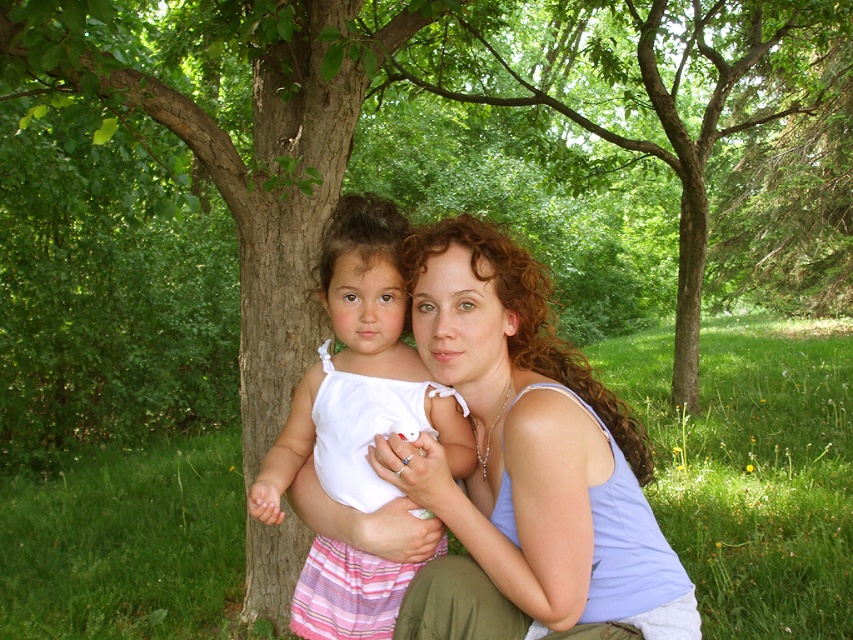
Can you confirm if green leafy tree at center is positioned above white cotton dress at center?

Yes, green leafy tree at center is above white cotton dress at center.

The image size is (853, 640). I want to click on green leafy tree at center, so click(x=688, y=125).

In the scene shown: Is light blue tank top at center above white cotton dress at center?

Yes.

Does light blue tank top at center have a lesser width compared to white cotton dress at center?

Incorrect, light blue tank top at center's width is not less than white cotton dress at center's.

Is point (605, 481) more distant than point (410, 396)?

No, (605, 481) is closer to viewer.

The height and width of the screenshot is (640, 853). In order to click on light blue tank top at center in this screenshot , I will do `click(523, 460)`.

Describe the element at coordinates (688, 125) in the screenshot. The width and height of the screenshot is (853, 640). I see `green leafy tree at center` at that location.

Between green leafy tree at center and light blue tank top at center, which one is positioned higher?

green leafy tree at center is above.

Between point (811, 196) and point (613, 461), which one is positioned in front?

Positioned in front is point (613, 461).

Locate an element on the screen. This screenshot has width=853, height=640. green leafy tree at center is located at coordinates (688, 125).